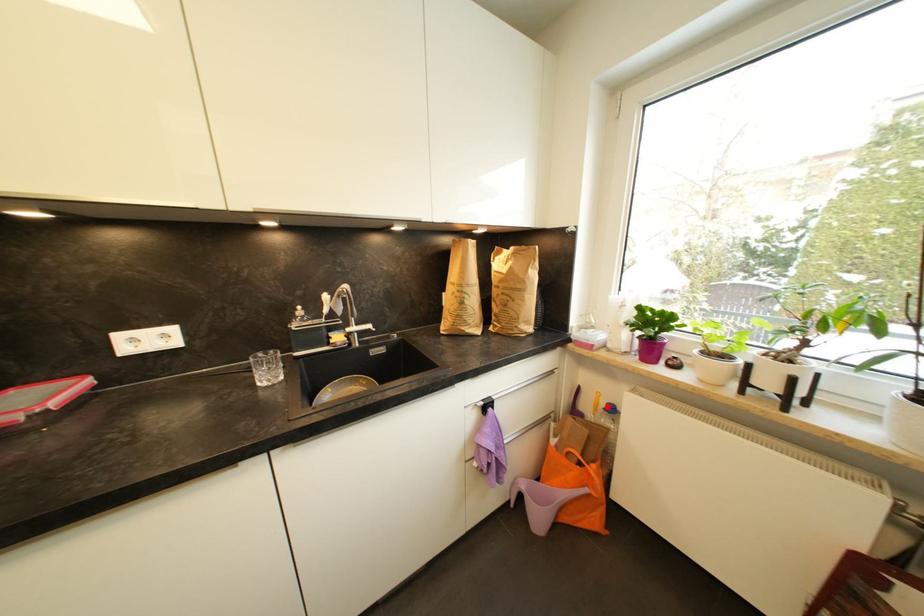
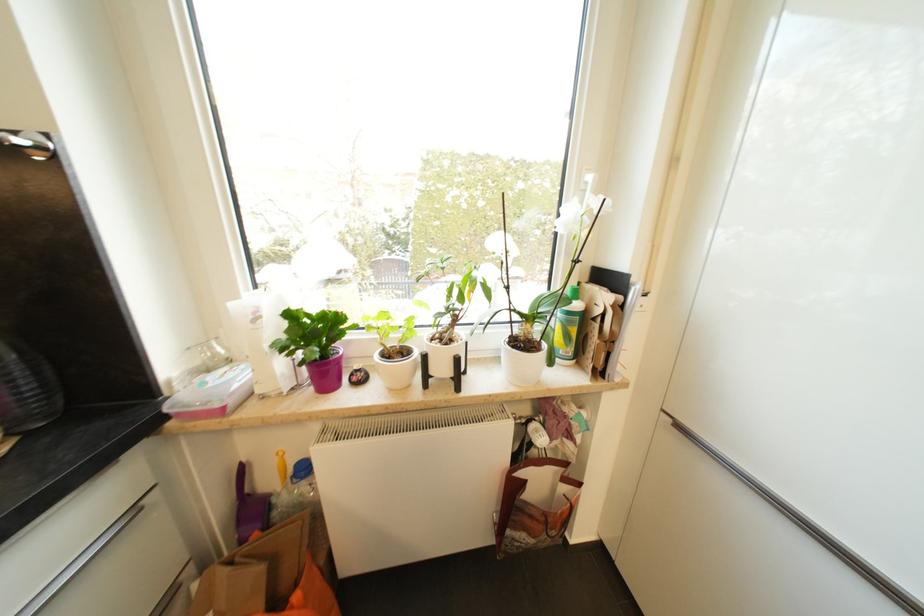
Locate, in the second image, the point that corresponds to the highlighted location in the first image.

(295, 471)